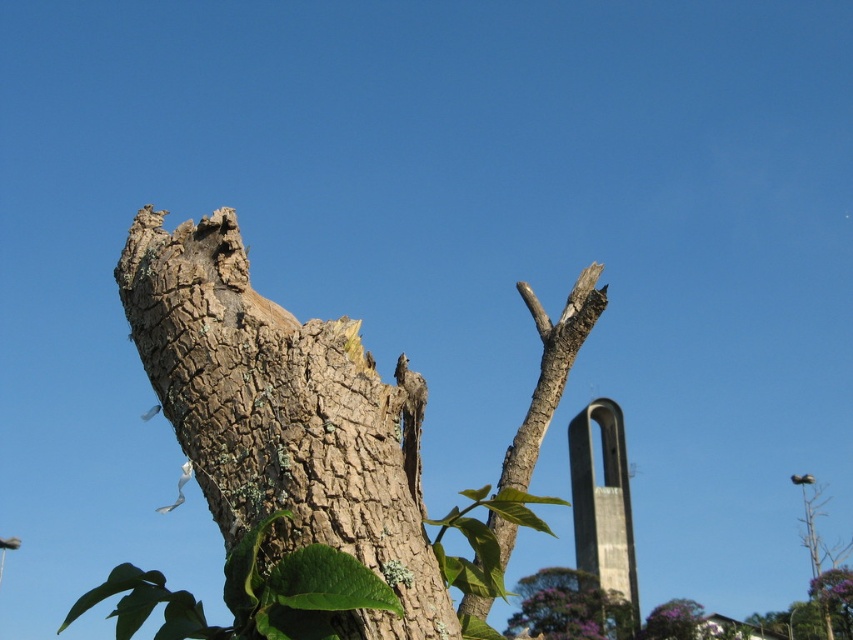
Question: Which point is farther to the camera?

Choices:
 (A) (674, 618)
 (B) (566, 369)
 (C) (595, 540)

Answer: (C)

Question: Which point is farther from the camera taking this photo?

Choices:
 (A) (671, 636)
 (B) (585, 481)
 (C) (498, 484)
 (D) (212, 298)

Answer: (B)

Question: Considering the real-world distances, which object is closest to the concrete tower at center?

Choices:
 (A) brown rough bark branch at upper center
 (B) purple leafy tree at lower right
 (C) brown rough bark at center
 (D) smooth gray tree trunk at center

Answer: (D)

Question: Can you confirm if concrete tower at center is positioned below smooth gray tree trunk at center?

Choices:
 (A) no
 (B) yes

Answer: (A)

Question: Does brown rough bark branch at upper center have a greater width compared to smooth gray tree trunk at center?

Choices:
 (A) no
 (B) yes

Answer: (A)

Question: Does brown rough bark at center lie in front of purple leafy tree at lower right?

Choices:
 (A) yes
 (B) no

Answer: (A)